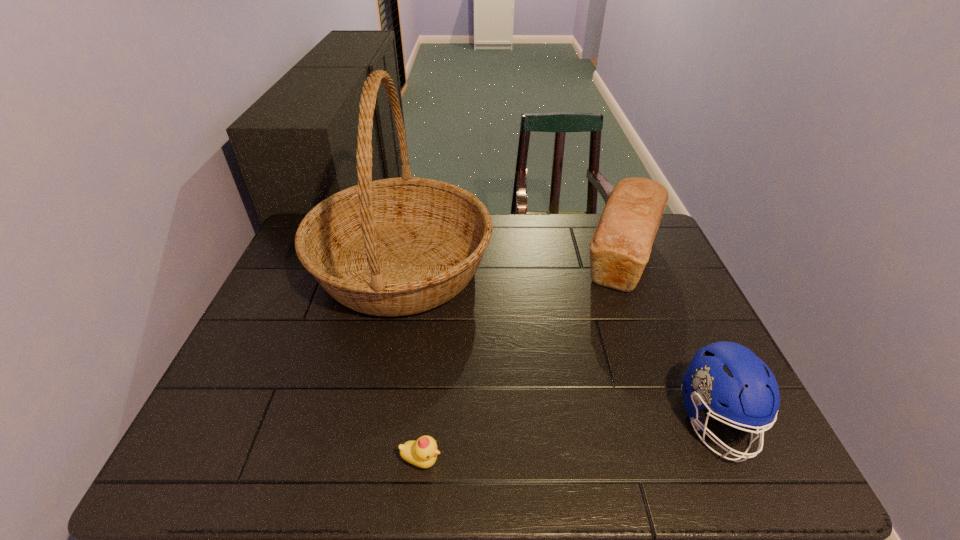
Locate an element on the screen. This screenshot has width=960, height=540. duckling at the near edge is located at coordinates 423,452.

Find the location of a particular element. The image size is (960, 540). object that is at the left edge is located at coordinates (400, 246).

What are the coordinates of `bread that is positioned at the right edge` in the screenshot? It's located at (620, 247).

In order to click on football helmet located at the right edge in this screenshot , I will do `click(723, 372)`.

This screenshot has height=540, width=960. Identify the location of object that is at the far left corner. (400, 246).

At what (x,y) coordinates should I click in order to perform the action: click on object present at the far right corner. Please return your answer as a coordinate pair (x, y). The width and height of the screenshot is (960, 540). Looking at the image, I should click on [620, 247].

The height and width of the screenshot is (540, 960). What are the coordinates of `object located at the near right corner` in the screenshot? It's located at (723, 372).

In the image, there is a desktop. Where is `blank space at the far edge`? blank space at the far edge is located at coordinates (571, 242).

This screenshot has width=960, height=540. I want to click on vacant region at the near edge of the desktop, so click(332, 448).

Identify the location of vacant position at the left edge of the desktop. Image resolution: width=960 pixels, height=540 pixels. (300, 292).